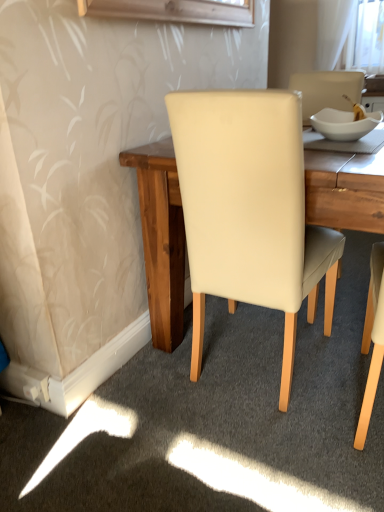
Question: In the image, is white glossy bowl at upper right on the left side or the right side of cream leather chair at center?

Choices:
 (A) left
 (B) right

Answer: (B)

Question: From a real-world perspective, is white glossy bowl at upper right physically located above or below cream leather chair at center?

Choices:
 (A) above
 (B) below

Answer: (A)

Question: Is white glossy bowl at upper right taller or shorter than cream leather chair at center?

Choices:
 (A) tall
 (B) short

Answer: (B)

Question: In terms of width, does cream leather chair at center look wider or thinner when compared to white glossy bowl at upper right?

Choices:
 (A) wide
 (B) thin

Answer: (A)

Question: From their relative heights in the image, would you say cream leather chair at center is taller or shorter than white glossy bowl at upper right?

Choices:
 (A) short
 (B) tall

Answer: (B)

Question: From the image's perspective, is cream leather chair at center above or below white glossy bowl at upper right?

Choices:
 (A) below
 (B) above

Answer: (A)

Question: Would you say cream leather chair at center is inside or outside white glossy bowl at upper right?

Choices:
 (A) outside
 (B) inside

Answer: (A)